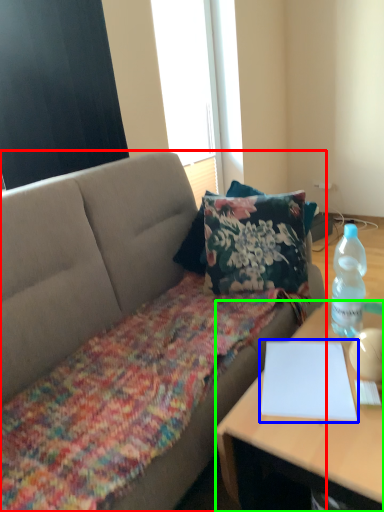
Question: Estimate the real-world distances between objects in this image. Which object is farther from studio couch (highlighted by a red box), notebook (highlighted by a blue box) or desk (highlighted by a green box)?

Choices:
 (A) notebook
 (B) desk

Answer: (B)